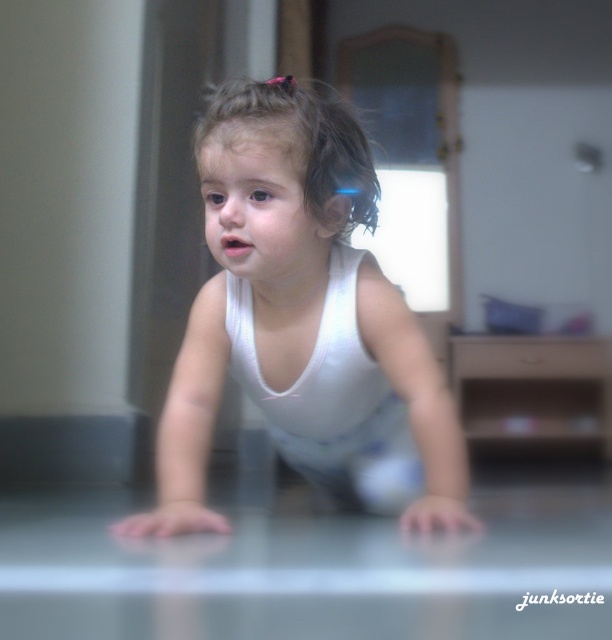
Consider the image. Is white matte toddler at center positioned before brown curly hair at center?

Yes.

Is white matte toddler at center thinner than brown curly hair at center?

No.

Find the location of a particular element. Image resolution: width=612 pixels, height=640 pixels. white matte toddler at center is located at coordinates (304, 323).